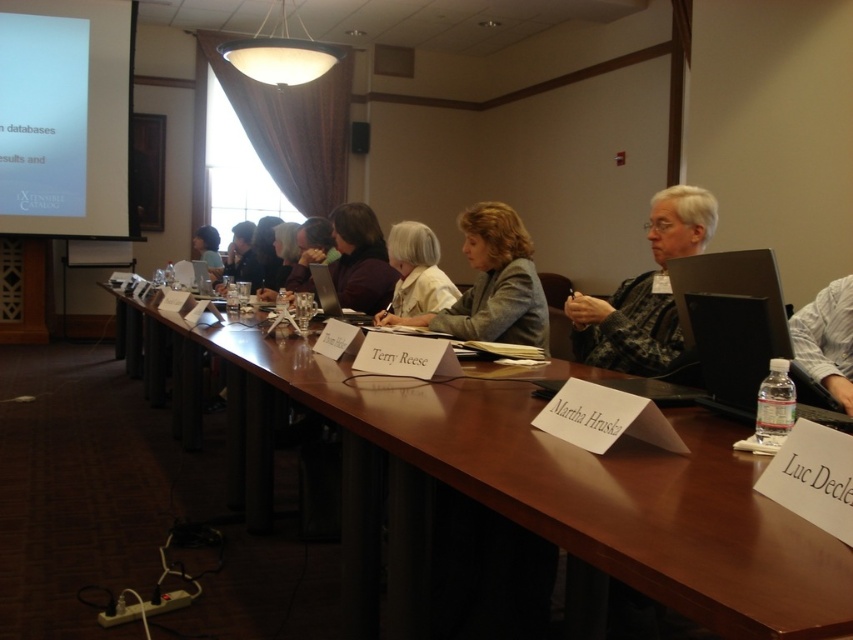
You are a photographer standing at the back of the room. You want to take a photo of the plaid fabric shirt at center and the white matte shirt at center. The minimum distance required for your camera to focus on both subjects clearly is 3 feet. Can you capture both shirts in focus without moving closer?

The plaid fabric shirt at center is 3.38 feet from the white matte shirt at center. Since the minimum focus distance required is 3 feet, the 3.38 feet distance exceeds this requirement, so yes, the photographer can capture both shirts in focus without moving closer.

You are a photographer standing behind the wooden table at the back of the room. You want to take a photo of the plaid fabric shirt at center and the light gray fabric jacket at center. Which object is closer to you?

The plaid fabric shirt at center is in front of the light gray fabric jacket at center, so the plaid fabric shirt at center is closer to you.